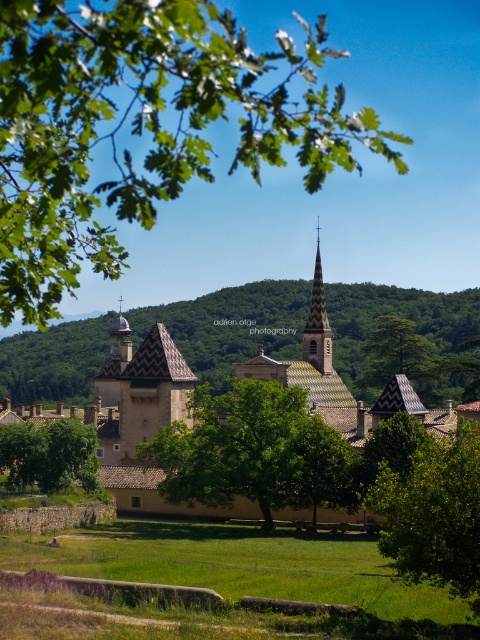
Which of these two, green leafy tree at center or green leafy tree at lower left, stands taller?

With more height is green leafy tree at center.

Is green leafy tree at center positioned before green leafy tree at lower left?

That is True.

Find the location of a particular element. This screenshot has height=640, width=480. green leafy tree at center is located at coordinates (253, 451).

Which is more to the left, green leafy branch at upper left or green leafy tree at center?

green leafy tree at center

Which is below, green leafy branch at upper left or green leafy tree at center?

green leafy tree at center is lower down.

In order to click on green leafy branch at upper left in this screenshot , I will do `click(144, 125)`.

Who is taller, green leafy branch at upper left or green leafy tree at lower right?

green leafy branch at upper left

This screenshot has width=480, height=640. Find the location of `green leafy branch at upper left`. green leafy branch at upper left is located at coordinates 144,125.

Who is more forward, (x=163, y=192) or (x=441, y=461)?

Point (x=163, y=192) is in front.

Find the location of a particular element. This screenshot has width=480, height=640. green leafy branch at upper left is located at coordinates (144, 125).